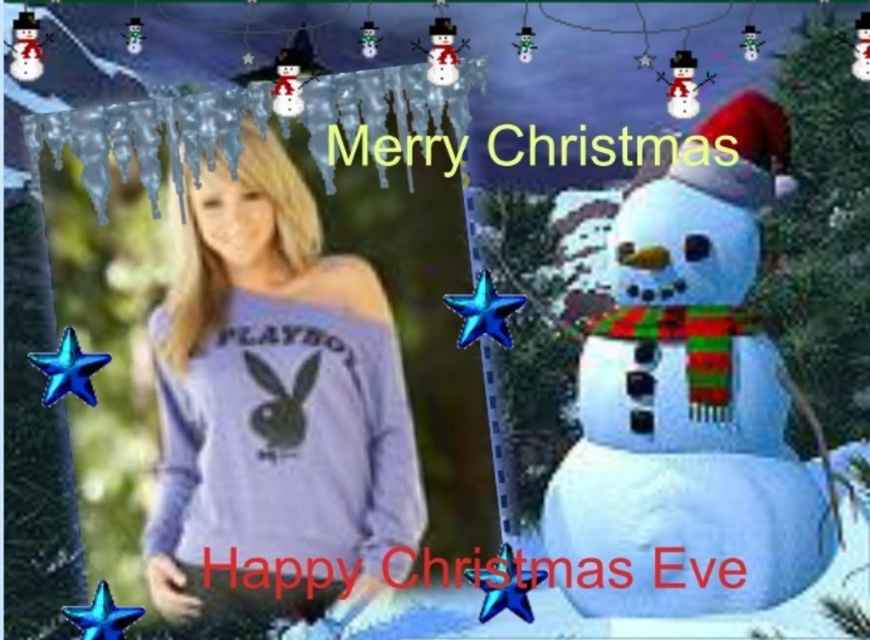
You are designing a holiday greeting card and want to ensure proper spacing between the matte purple sweatshirt at center and the white matte snowman at right. Given their widths, which object should be placed closer to the edge to maintain balance?

The matte purple sweatshirt at center has a lesser width compared to the white matte snowman at right, so to maintain balance, the wider white matte snowman at right should be placed closer to the edge to compensate for its larger size.

You are designing a holiday card and need to ensure the matte purple sweatshirt at center and the white matte snowman at right are proportionally sized. Based on the image, which object should be scaled down to maintain visual balance?

The white matte snowman at right should be scaled down because the matte purple sweatshirt at center has a lesser height compared to the white matte snowman at right, so reducing the snowman size would help balance both elements.

You are standing in front of the festive Christmas collage. Which object is closer to you, the matte purple sweatshirt at center or the white matte snowman at right?

The matte purple sweatshirt at center is closer to you because it is further to the viewer than the white matte snowman at right.